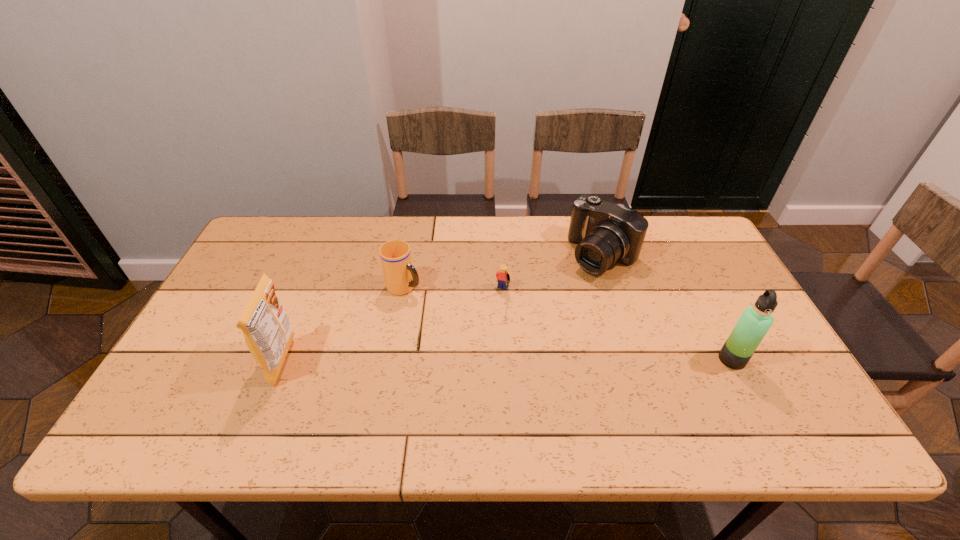
Locate an element on the screen. Image resolution: width=960 pixels, height=540 pixels. vacant region located 0.250m on the front-facing side of the third object from right to left is located at coordinates (468, 370).

The width and height of the screenshot is (960, 540). Identify the location of vacant space located on the front-facing side of the third object from right to left. (454, 401).

Identify the location of free space located on the front-facing side of the third object from right to left. (481, 343).

Where is `free region located on the lens of the camera`? free region located on the lens of the camera is located at coordinates (545, 312).

The image size is (960, 540). Find the location of `vacant space situated 0.290m on the lens of the camera`. vacant space situated 0.290m on the lens of the camera is located at coordinates (525, 330).

Locate an element on the screen. The image size is (960, 540). vacant space situated 0.070m on the lens of the camera is located at coordinates coord(572,288).

Where is `free location located 0.180m on the side of the cup with the handle`? The height and width of the screenshot is (540, 960). free location located 0.180m on the side of the cup with the handle is located at coordinates (468, 320).

Find the location of a particular element. Image resolution: width=960 pixels, height=540 pixels. blank space located 0.050m on the side of the cup with the handle is located at coordinates (431, 300).

Identify the location of blank space located on the side of the cup with the handle. Image resolution: width=960 pixels, height=540 pixels. (539, 358).

Identify the location of object that is at the far edge. The height and width of the screenshot is (540, 960). (606, 233).